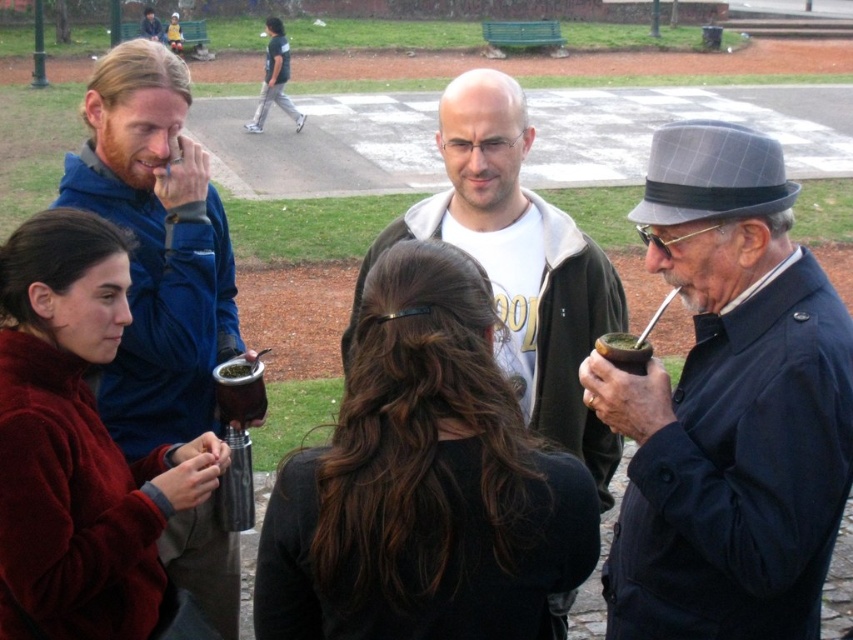
Is dark brown hair at center smaller than dark gray pants at upper center?

Yes.

Who is lower down, dark brown hair at center or dark gray pants at upper center?

dark brown hair at center

The width and height of the screenshot is (853, 640). What do you see at coordinates (422, 483) in the screenshot?
I see `dark brown hair at center` at bounding box center [422, 483].

Where is `dark brown hair at center`? dark brown hair at center is located at coordinates (422, 483).

Between dark brown hair at center and velvet maroon sweater at lower left, which one appears on the left side from the viewer's perspective?

Positioned to the left is velvet maroon sweater at lower left.

Between dark brown hair at center and velvet maroon sweater at lower left, which one has more height?

velvet maroon sweater at lower left

Which is in front, point (379, 291) or point (49, 616)?

Positioned in front is point (379, 291).

In order to click on dark brown hair at center in this screenshot , I will do `click(422, 483)`.

Is dark blue jacket at center wider than velvet maroon sweater at lower left?

Yes, dark blue jacket at center is wider than velvet maroon sweater at lower left.

Can you confirm if dark blue jacket at center is shorter than velvet maroon sweater at lower left?

Incorrect, dark blue jacket at center's height does not fall short of velvet maroon sweater at lower left's.

Who is more distant from viewer, (630, 419) or (67, 252)?

Positioned behind is point (67, 252).

Where is `dark blue jacket at center`? The height and width of the screenshot is (640, 853). dark blue jacket at center is located at coordinates (728, 406).